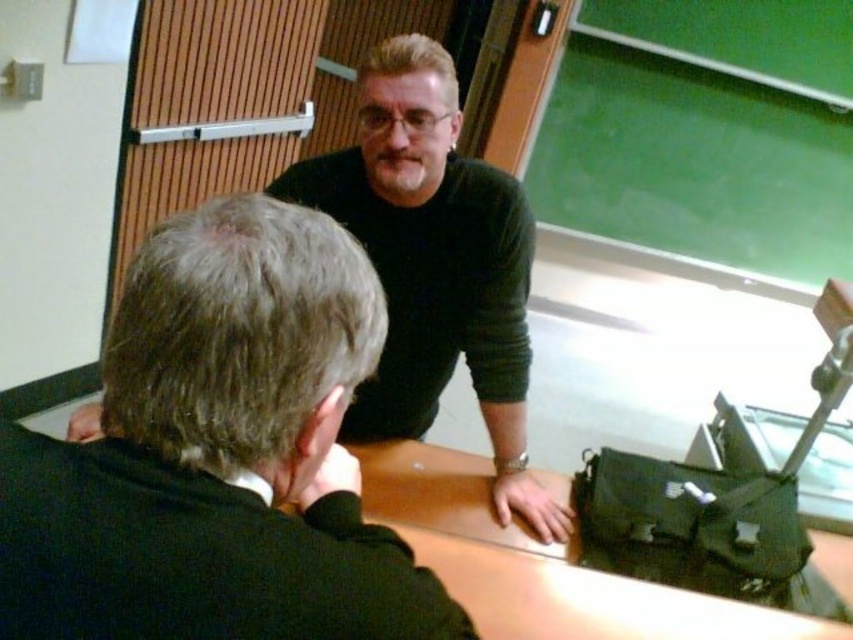
You are a fashion designer observing two sweaters displayed on mannequins in a store window. The sweaters are the dark green sweater at upper center and the black matte sweater at upper center. Which sweater has a smaller width?

The dark green sweater at upper center has a smaller width than the black matte sweater at upper center.